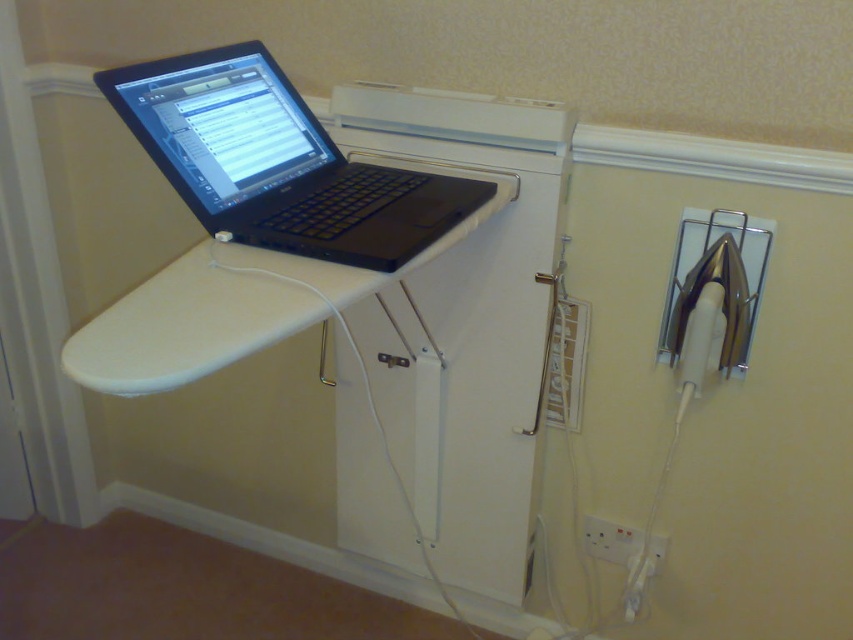
Question: Can you confirm if black matte laptop at upper left is smaller than white plastic electric outlet at lower center?

Choices:
 (A) no
 (B) yes

Answer: (A)

Question: Which point is closer to the camera?

Choices:
 (A) white plastic electric outlet at lower center
 (B) black matte laptop at upper left

Answer: (B)

Question: Which of the following is the farthest from the observer?

Choices:
 (A) white plastic electric outlet at lower center
 (B) black matte laptop at upper left

Answer: (A)

Question: Does black matte laptop at upper left lie in front of white plastic electric outlet at lower center?

Choices:
 (A) yes
 (B) no

Answer: (A)

Question: Can you confirm if black matte laptop at upper left is wider than white plastic electric outlet at lower center?

Choices:
 (A) no
 (B) yes

Answer: (B)

Question: Which object appears closest to the camera in this image?

Choices:
 (A) white plastic electric outlet at lower center
 (B) black matte laptop at upper left

Answer: (B)